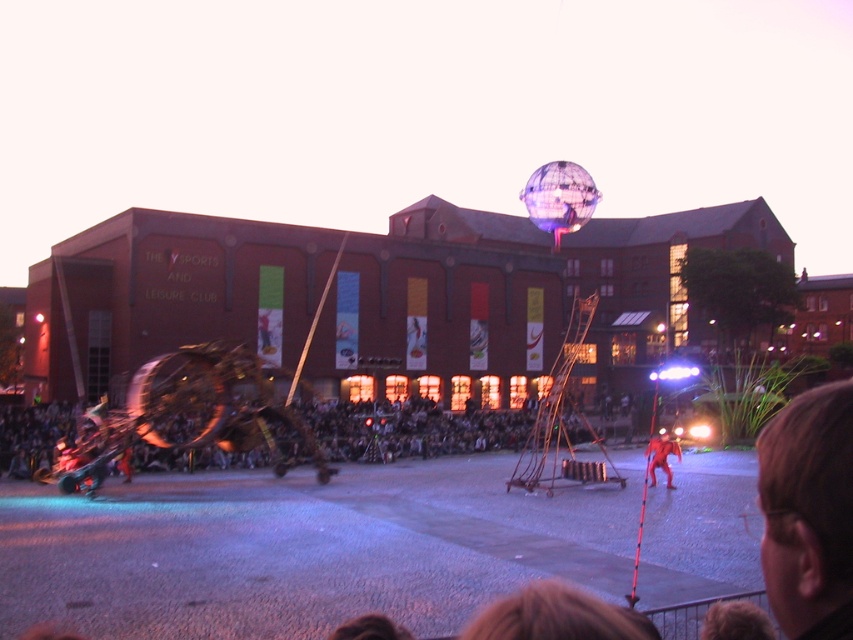
Does dark brown wooden bench at lower center appear on the right side of translucent purple sphere at upper center?

No, dark brown wooden bench at lower center is not to the right of translucent purple sphere at upper center.

You are a GUI agent. You are given a task and a screenshot of the screen. Output one action in this format:
    pyautogui.click(x=<x>, y=<y>)
    Task: Click on the dark brown wooden bench at lower center
    The width and height of the screenshot is (853, 640).
    Given the screenshot: What is the action you would take?
    pyautogui.click(x=412, y=429)

Where is `dark brown wooden bench at lower center`? dark brown wooden bench at lower center is located at coordinates (412, 429).

Is point (541, 216) more distant than point (663, 444)?

Yes, it is.

Does translucent purple sphere at upper center have a greater height compared to red fabric person at center?

Correct, translucent purple sphere at upper center is much taller as red fabric person at center.

The width and height of the screenshot is (853, 640). What do you see at coordinates (560, 196) in the screenshot?
I see `translucent purple sphere at upper center` at bounding box center [560, 196].

Image resolution: width=853 pixels, height=640 pixels. I want to click on translucent purple sphere at upper center, so click(x=560, y=196).

How distant is dark brown wooden bench at lower center from red fabric person at center?

The distance of dark brown wooden bench at lower center from red fabric person at center is 62.08 feet.

Can you confirm if dark brown wooden bench at lower center is positioned to the left of red fabric person at center?

Yes, dark brown wooden bench at lower center is to the left of red fabric person at center.

Is point (384, 436) positioned behind point (651, 451)?

Yes, it is.

You are a GUI agent. You are given a task and a screenshot of the screen. Output one action in this format:
    pyautogui.click(x=<x>, y=<y>)
    Task: Click on the dark brown wooden bench at lower center
    
    Given the screenshot: What is the action you would take?
    pyautogui.click(x=412, y=429)